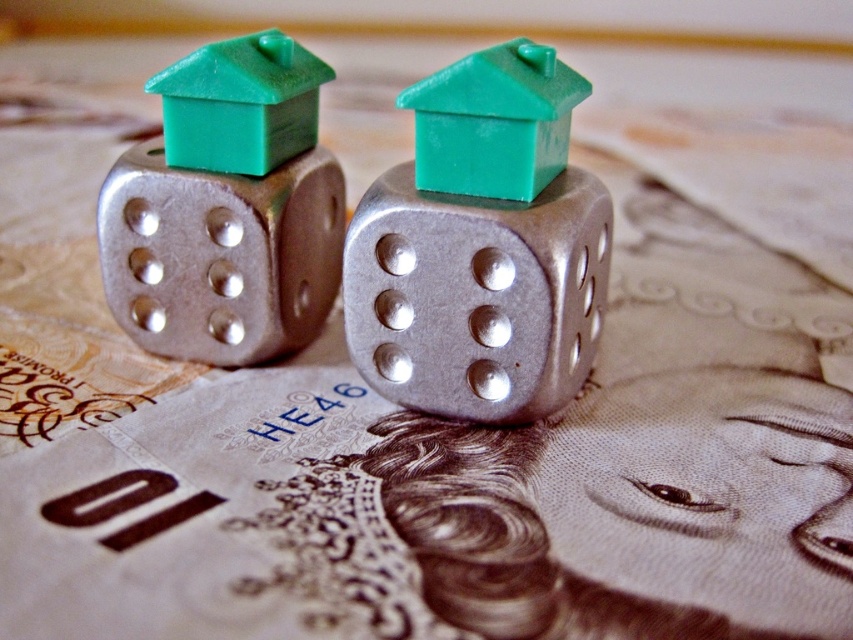
Measure the distance between green plastic house at center and black paper at lower left.

The distance of green plastic house at center from black paper at lower left is 50.12 centimeters.

Which is behind, point (424, 163) or point (84, 516)?

The point (424, 163) is behind.

Where is `green plastic house at center`? Image resolution: width=853 pixels, height=640 pixels. green plastic house at center is located at coordinates (494, 122).

Is point (383, 268) more distant than point (111, 280)?

No, (383, 268) is in front of (111, 280).

Does brushed metal dice at center appear over metallic silver dice at left?

Incorrect, brushed metal dice at center is not positioned above metallic silver dice at left.

Is point (560, 362) positioned before point (125, 196)?

Yes, point (560, 362) is closer to viewer.

Find the location of a particular element. brushed metal dice at center is located at coordinates (476, 296).

Is metallic silver dice at left taller than black paper at lower left?

Yes.

The image size is (853, 640). In order to click on metallic silver dice at left in this screenshot , I will do `click(219, 256)`.